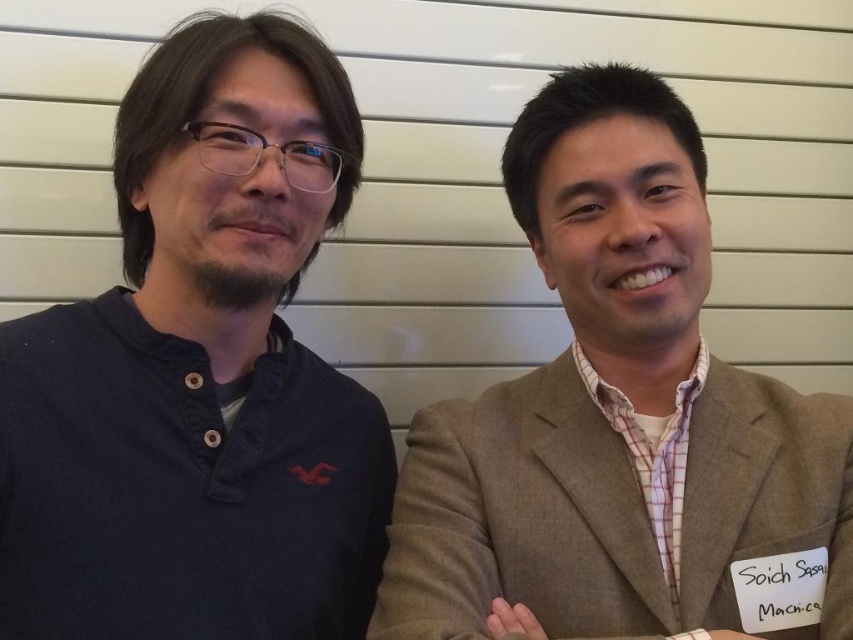
Question: Does dark blue button-up shirt at left appear over brown textured suit at right?

Choices:
 (A) no
 (B) yes

Answer: (B)

Question: Among these objects, which one is farthest from the camera?

Choices:
 (A) dark blue button-up shirt at left
 (B) brown textured suit at right

Answer: (B)

Question: Is dark blue button-up shirt at left positioned at the back of brown textured suit at right?

Choices:
 (A) no
 (B) yes

Answer: (A)

Question: Can you confirm if dark blue button-up shirt at left is bigger than brown textured suit at right?

Choices:
 (A) no
 (B) yes

Answer: (A)

Question: Which of the following is the closest to the observer?

Choices:
 (A) (654, 138)
 (B) (160, 488)

Answer: (B)